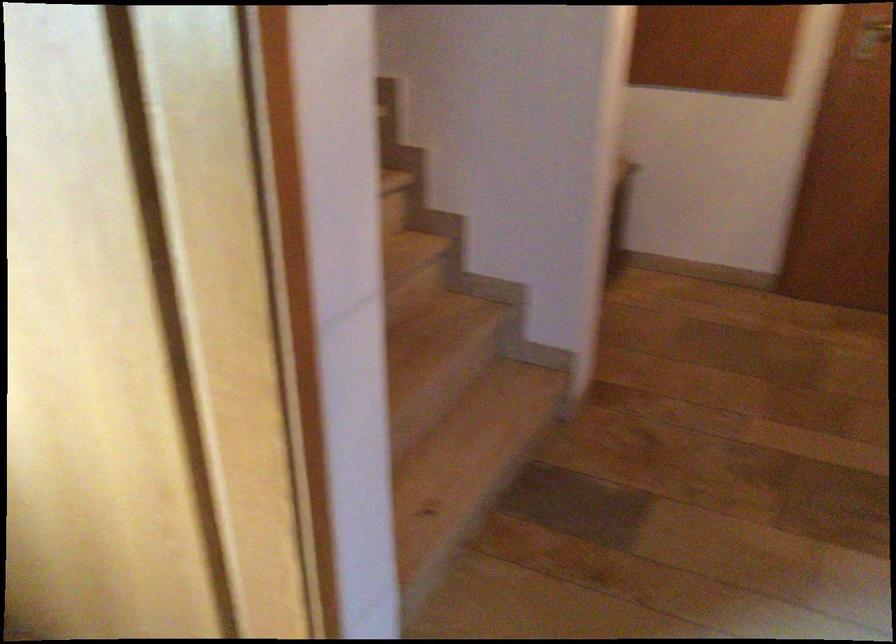
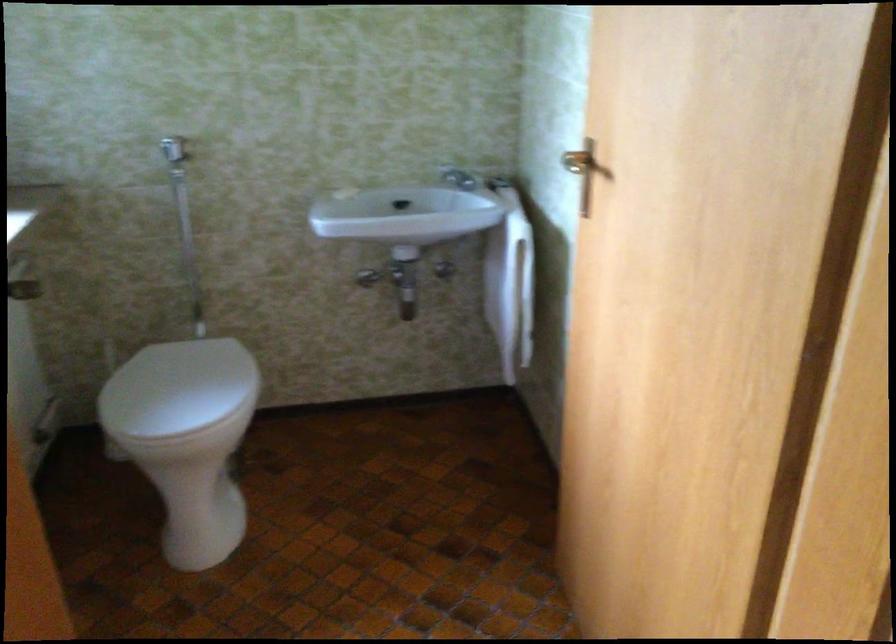
Question: The camera is either moving clockwise (left) or counter-clockwise (right) around the object. The first image is from the beginning of the video and the second image is from the end. Is the camera moving left or right when shooting the video?

Choices:
 (A) Left
 (B) Right

Answer: (B)